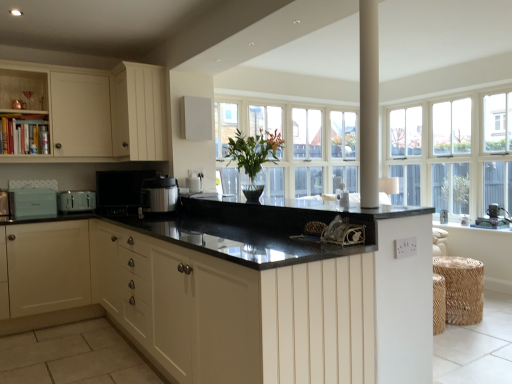
Question: Is green glossy vase at center at the left side of white textured window sill at right?

Choices:
 (A) yes
 (B) no

Answer: (A)

Question: Could you tell me if green glossy vase at center is facing white textured window sill at right?

Choices:
 (A) yes
 (B) no

Answer: (B)

Question: From the image's perspective, would you say green glossy vase at center is shown under white textured window sill at right?

Choices:
 (A) yes
 (B) no

Answer: (B)

Question: Is green glossy vase at center smaller than white textured window sill at right?

Choices:
 (A) yes
 (B) no

Answer: (B)

Question: From the image's perspective, is green glossy vase at center located above white textured window sill at right?

Choices:
 (A) no
 (B) yes

Answer: (B)

Question: Is point (368, 210) positioned closer to the camera than point (71, 210)?

Choices:
 (A) closer
 (B) farther

Answer: (A)

Question: From a real-world perspective, relative to matte silver toaster at left, which is the 2th appliance in left-to-right order, is black granite countertop at center, the 1th countertop viewed from the top, vertically above or below?

Choices:
 (A) above
 (B) below

Answer: (A)

Question: In terms of width, does black granite countertop at center, which appears as the 2th countertop when ordered from the bottom, look wider or thinner when compared to matte silver toaster at left, which is the 4th appliance in right-to-left order?

Choices:
 (A) thin
 (B) wide

Answer: (B)

Question: Is black granite countertop at center, which appears as the 2th countertop when ordered from the bottom, bigger or smaller than matte silver toaster at left, which is the 4th appliance in right-to-left order?

Choices:
 (A) big
 (B) small

Answer: (A)

Question: Is matte silver toaster at left, which is the 2th appliance in left-to-right order, inside the boundaries of white wooden window at upper right, or outside?

Choices:
 (A) inside
 (B) outside

Answer: (B)

Question: From a real-world perspective, is matte silver toaster at left, which is the 4th appliance in right-to-left order, positioned above or below white wooden window at upper right?

Choices:
 (A) below
 (B) above

Answer: (A)

Question: From the image's perspective, relative to white wooden window at upper right, is matte silver toaster at left, which is the 2th appliance in left-to-right order, above or below?

Choices:
 (A) above
 (B) below

Answer: (B)

Question: Considering their positions, is matte silver toaster at left, which is the 4th appliance in right-to-left order, located in front of or behind white wooden window at upper right?

Choices:
 (A) front
 (B) behind

Answer: (A)

Question: Looking at their shapes, would you say white matte speaker at upper center, positioned as the fifth appliance in left-to-right order, is wider or thinner than woven straw stool at lower right?

Choices:
 (A) wide
 (B) thin

Answer: (B)

Question: Considering the relative positions of white matte speaker at upper center, positioned as the fifth appliance in left-to-right order, and woven straw stool at lower right in the image provided, is white matte speaker at upper center, positioned as the fifth appliance in left-to-right order, to the left or to the right of woven straw stool at lower right?

Choices:
 (A) right
 (B) left

Answer: (B)